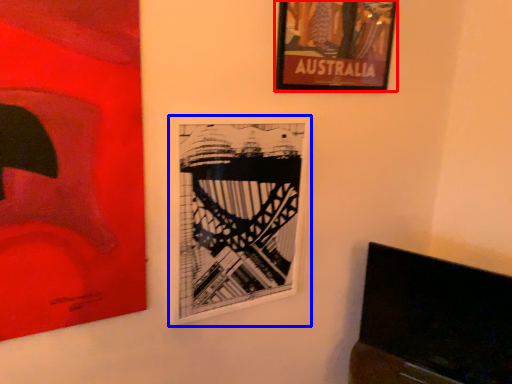
Question: Which object appears closest to the camera in this image, picture frame (highlighted by a red box) or picture frame (highlighted by a blue box)?

Choices:
 (A) picture frame
 (B) picture frame

Answer: (B)